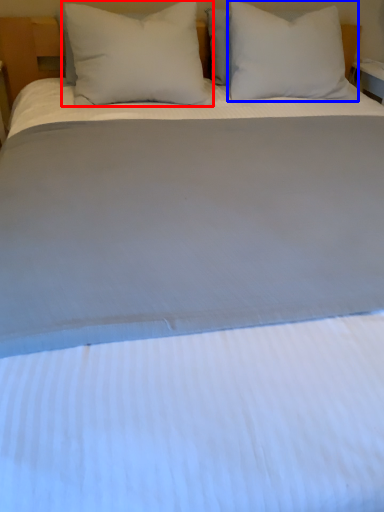
Question: Which of the following is the farthest to the observer, pillow (highlighted by a red box) or pillow (highlighted by a blue box)?

Choices:
 (A) pillow
 (B) pillow

Answer: (B)